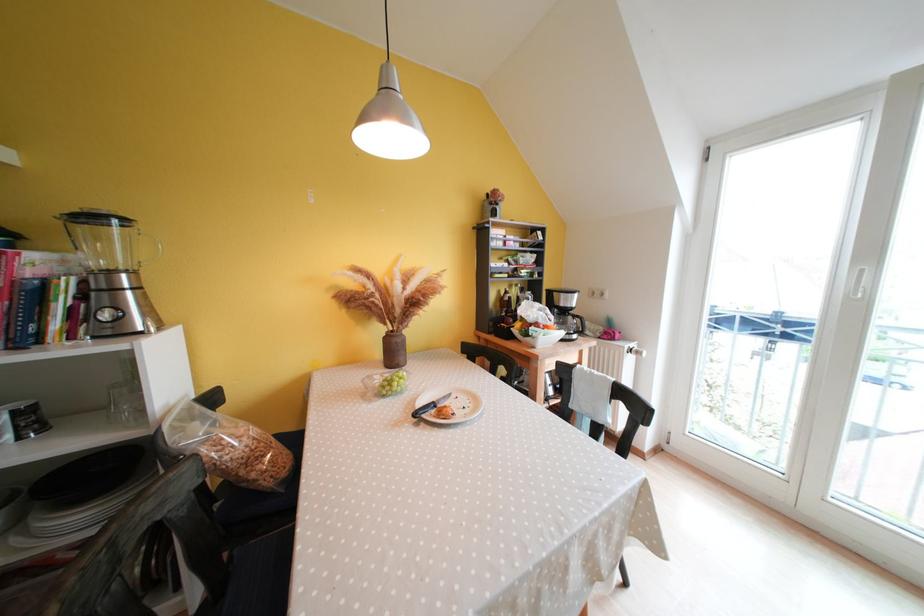
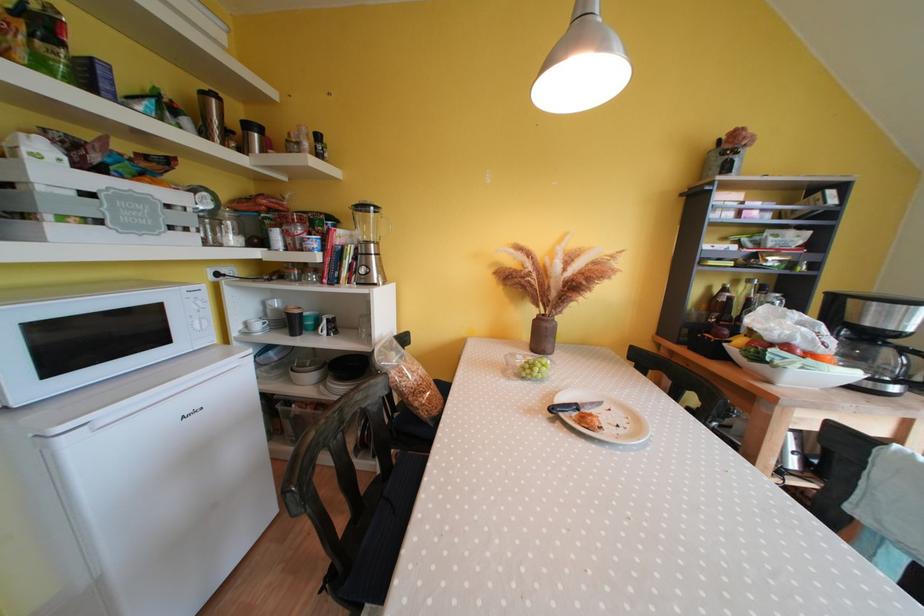
The point at (440, 408) is marked in the first image. Where is the corresponding point in the second image?

(582, 410)